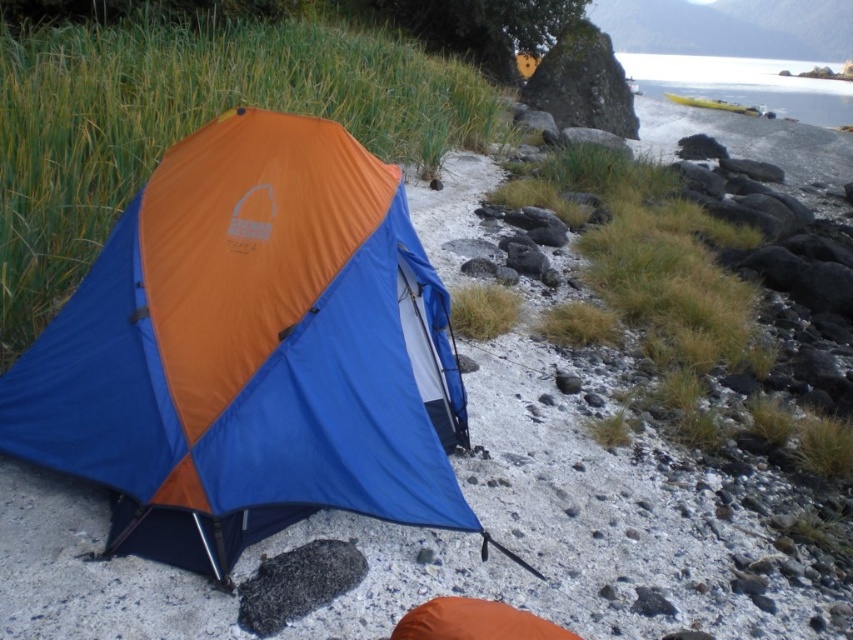
You are planning to set up a tent in this camping area. You see the orange fabric tent at center and the yellow plastic kayak at upper right. Which object is positioned higher in the image?

The yellow plastic kayak at upper right is positioned higher in the image than the orange fabric tent at center.

You are standing at the edge of the rocky beach where the camping scene is set. There is a point marked at coordinates (114,432). If you want to place a 3 meter long tent, will the point be within the tent area?

The point at (114,432) is 2.53 meters away from the viewer. Since the tent is 3 meters long, the point could be within the tent area depending on the tent orientation and exact placement.

You are standing at the point marked by the coordinates point (252, 352) in the camping scene. What object are you directly at?

The point (252, 352) indicates the orange fabric tent at center, so you are directly at the orange fabric tent at center.